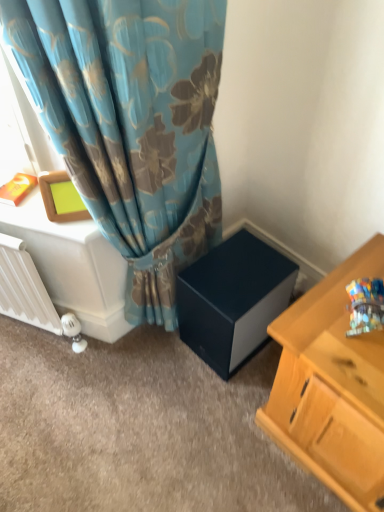
Where is `free space in front of matte black cube at center`? The height and width of the screenshot is (512, 384). free space in front of matte black cube at center is located at coordinates (227, 404).